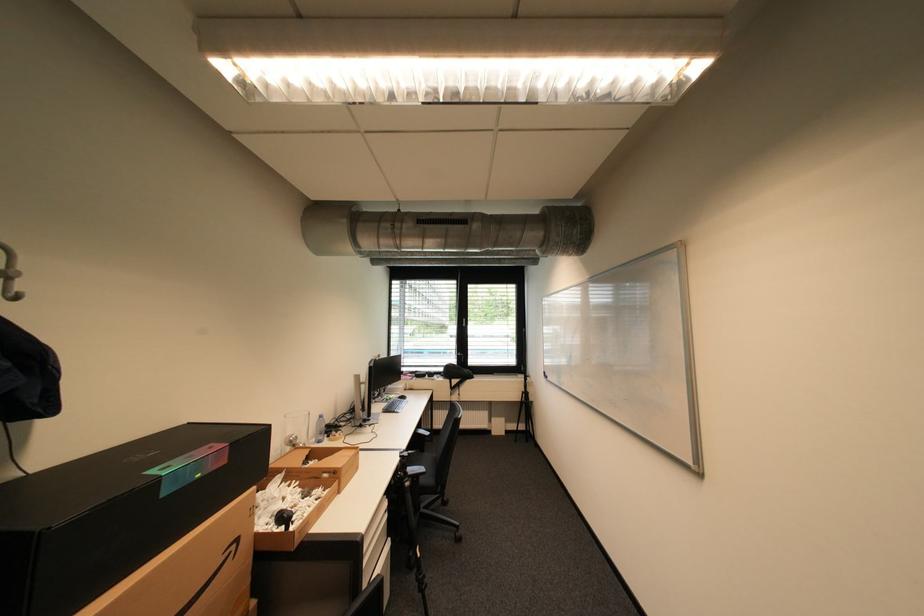
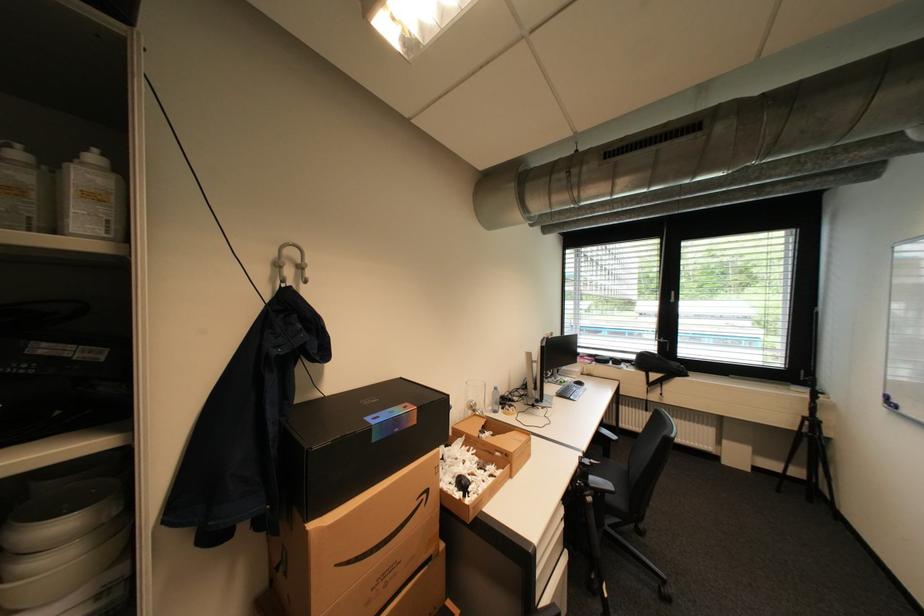
Where in the second image is the point corresponding to [207,476] from the first image?

(405, 431)